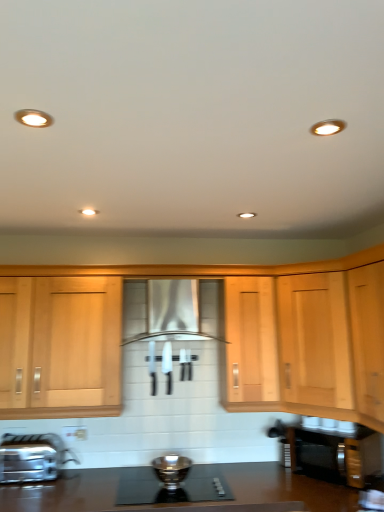
Find the location of `black glass gas stove at center`. black glass gas stove at center is located at coordinates (171, 490).

What is the approximate width of white plastic electric outlet at lower center?

2.02 centimeters.

What is the approximate width of satin nickel faucet at lower left?

The width of satin nickel faucet at lower left is 9.45 inches.

The image size is (384, 512). Describe the element at coordinates (165, 312) in the screenshot. I see `satin silver range hood at center` at that location.

Locate an element on the screen. This screenshot has height=512, width=384. black glass gas stove at center is located at coordinates (171, 490).

Is satin nickel faucet at lower left located within white plastic electric outlet at lower center?

No, satin nickel faucet at lower left is located outside of white plastic electric outlet at lower center.

How many degrees apart are the facing directions of white plastic electric outlet at lower center and satin nickel faucet at lower left?

The facing directions of white plastic electric outlet at lower center and satin nickel faucet at lower left are 0.771 degrees apart.

From a real-world perspective, which object rests below the other?

In real-world perspective, satin nickel faucet at lower left is lower.

From the image's perspective, is white plastic electric outlet at lower center located above or below satin nickel faucet at lower left?

From the image's perspective, white plastic electric outlet at lower center appears above satin nickel faucet at lower left.

Between light wood cabinet at right and satin nickel faucet at lower left, which one has larger width?

light wood cabinet at right.

Is light wood cabinet at right far from satin nickel faucet at lower left?

Yes.

Is light wood cabinet at right positioned with its back to satin nickel faucet at lower left?

light wood cabinet at right does not have its back to satin nickel faucet at lower left.

Considering the relative positions of light wood cabinet at right and satin nickel faucet at lower left in the image provided, is light wood cabinet at right to the left of satin nickel faucet at lower left from the viewer's perspective?

In fact, light wood cabinet at right is to the right of satin nickel faucet at lower left.

Is satin nickel faucet at lower left at the left side of white plastic electric outlet at lower center?

Yes.

From the image's perspective, is satin nickel faucet at lower left positioned above or below white plastic electric outlet at lower center?

Clearly, from the image's perspective, satin nickel faucet at lower left is below white plastic electric outlet at lower center.

Considering the points (8, 469) and (75, 435), which point is in front, point (8, 469) or point (75, 435)?

The point (8, 469) is closer.

Image resolution: width=384 pixels, height=512 pixels. In order to click on kitchen appliance that appears below the white plastic electric outlet at lower center (from the image's perspective) in this screenshot , I will do `click(32, 457)`.

Would you say satin silver range hood at center is outside white plastic electric outlet at lower center?

satin silver range hood at center is positioned outside white plastic electric outlet at lower center.

Is satin silver range hood at center oriented away from white plastic electric outlet at lower center?

No, satin silver range hood at center's orientation is not away from white plastic electric outlet at lower center.

Considering the points (169, 291) and (81, 436), which point is in front, point (169, 291) or point (81, 436)?

The point (169, 291) is closer.

From the image's perspective, between satin silver range hood at center and white plastic electric outlet at lower center, who is located below?

white plastic electric outlet at lower center is shown below in the image.

From the picture: Considering the sizes of objects satin silver range hood at center and satin nickel faucet at lower left in the image provided, who is shorter, satin silver range hood at center or satin nickel faucet at lower left?

With less height is satin nickel faucet at lower left.

From a real-world perspective, between satin silver range hood at center and satin nickel faucet at lower left, who is vertically higher?

satin silver range hood at center, from a real-world perspective.

How many degrees apart are the facing directions of satin silver range hood at center and satin nickel faucet at lower left?

They differ by 0.194 degrees in their facing directions.

Is satin silver range hood at center positioned behind satin nickel faucet at lower left?

No, satin silver range hood at center is in front of satin nickel faucet at lower left.

Which object is positioned more to the right, black glass gas stove at center or light wood cabinet at right?

From the viewer's perspective, light wood cabinet at right appears more on the right side.

Is black glass gas stove at center spatially inside light wood cabinet at right, or outside of it?

black glass gas stove at center is not inside light wood cabinet at right, it's outside.

Locate an element on the screen. The width and height of the screenshot is (384, 512). gas stove on the left of light wood cabinet at right is located at coordinates (171, 490).

From the picture: Is black glass gas stove at center positioned with its back to light wood cabinet at right?

black glass gas stove at center does not have its back to light wood cabinet at right.

Does satin silver bowl at center have a greater width compared to light wood cabinet at right?

Incorrect, the width of satin silver bowl at center does not surpass that of light wood cabinet at right.

Is satin silver bowl at center at the right side of light wood cabinet at right?

No, satin silver bowl at center is not to the right of light wood cabinet at right.

From a real-world perspective, which is physically below, satin silver bowl at center or light wood cabinet at right?

From a 3D spatial view, satin silver bowl at center is below.

From the image's perspective, is satin silver bowl at center located above or below light wood cabinet at right?

satin silver bowl at center is situated lower than light wood cabinet at right in the image.

Identify the location of kitchen appliance in front of the white plastic electric outlet at lower center. The image size is (384, 512). (32, 457).

The height and width of the screenshot is (512, 384). Find the location of `kitchen appliance that is under the light wood cabinet at right (from a real-world perspective)`. kitchen appliance that is under the light wood cabinet at right (from a real-world perspective) is located at coordinates (32, 457).

When comparing their distances from satin nickel faucet at lower left, does satin silver range hood at center or satin silver bowl at center seem closer?

The object closer to satin nickel faucet at lower left is satin silver bowl at center.

Looking at the image, which one is located further to satin nickel faucet at lower left, black glass gas stove at center or satin silver range hood at center?

satin silver range hood at center is positioned further to the anchor satin nickel faucet at lower left.

Estimate the real-world distances between objects in this image. Which object is closer to satin silver range hood at center, light wood cabinet at right or black glass gas stove at center?

light wood cabinet at right.

Estimate the real-world distances between objects in this image. Which object is further from light wood cabinet at right, black glass gas stove at center or satin nickel faucet at lower left?

satin nickel faucet at lower left is further to light wood cabinet at right.

When comparing their distances from light wood cabinet at right, does black glass gas stove at center or satin silver range hood at center seem closer?

satin silver range hood at center is positioned closer to the anchor light wood cabinet at right.

Which object lies further to the anchor point satin silver range hood at center, white plastic electric outlet at lower center or black glass gas stove at center?

Based on the image, black glass gas stove at center appears to be further to satin silver range hood at center.

Which object lies further to the anchor point satin silver range hood at center, light wood cabinet at right or satin nickel faucet at lower left?

satin nickel faucet at lower left is positioned further to the anchor satin silver range hood at center.

From the image, which object appears to be nearer to satin nickel faucet at lower left, satin silver bowl at center or satin silver range hood at center?

The object closer to satin nickel faucet at lower left is satin silver bowl at center.

Find the location of `electric outlet between satin silver range hood at center and satin nickel faucet at lower left from top to bottom`. electric outlet between satin silver range hood at center and satin nickel faucet at lower left from top to bottom is located at coordinates (75, 432).

Locate an element on the screen. This screenshot has height=512, width=384. appliance between satin nickel faucet at lower left and black glass gas stove at center from left to right is located at coordinates (171, 469).

The height and width of the screenshot is (512, 384). I want to click on kitchen appliance between satin silver range hood at center and black glass gas stove at center in the vertical direction, so click(32, 457).

The image size is (384, 512). Find the location of `electric outlet that lies between satin silver range hood at center and satin silver bowl at center from top to bottom`. electric outlet that lies between satin silver range hood at center and satin silver bowl at center from top to bottom is located at coordinates (75, 432).